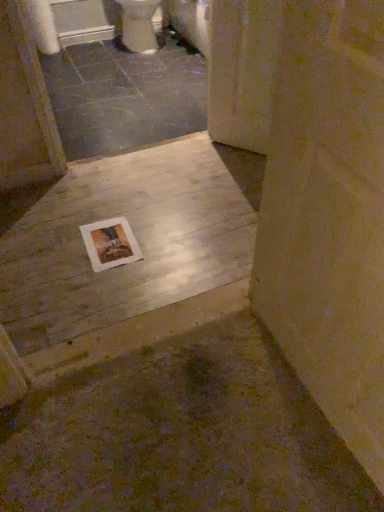
This screenshot has width=384, height=512. What are the coordinates of `free space in front of white paper at upper left` in the screenshot? It's located at (66, 67).